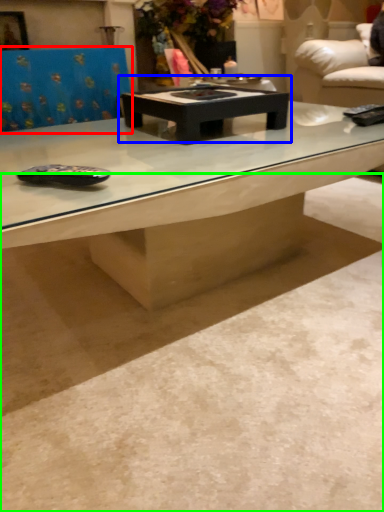
Question: Considering the real-world distances, which object is closest to swivel chair (highlighted by a red box)? coffee table (highlighted by a blue box) or concrete (highlighted by a green box).

Choices:
 (A) coffee table
 (B) concrete

Answer: (A)